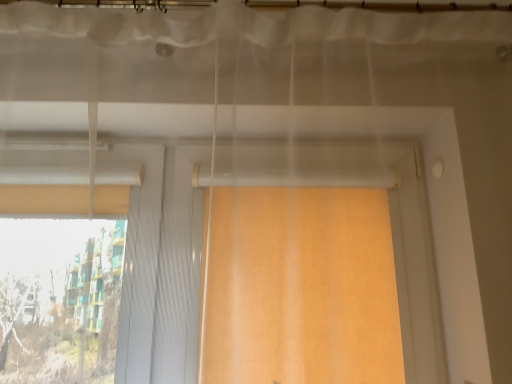
Find the location of `sheer white curtain at upper center`. sheer white curtain at upper center is located at coordinates (349, 52).

The height and width of the screenshot is (384, 512). What do you see at coordinates (349, 52) in the screenshot?
I see `sheer white curtain at upper center` at bounding box center [349, 52].

Where is `sheer white curtain at upper center`? This screenshot has width=512, height=384. sheer white curtain at upper center is located at coordinates (349, 52).